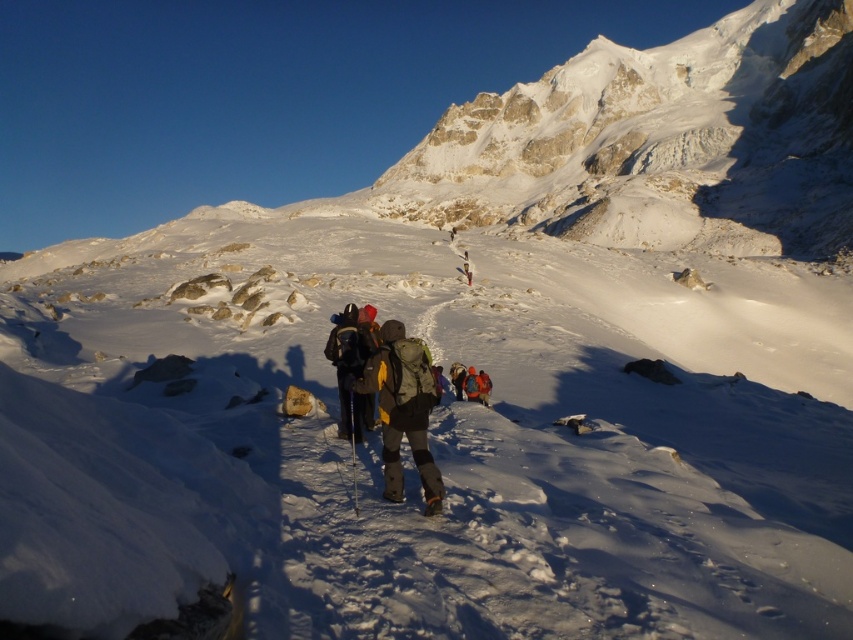
Does matte gray jacket at center have a larger size compared to matte black backpack at center?

Incorrect, matte gray jacket at center is not larger than matte black backpack at center.

Where is `matte gray jacket at center`? Image resolution: width=853 pixels, height=640 pixels. matte gray jacket at center is located at coordinates tap(403, 410).

Is point (387, 353) closer to viewer compared to point (354, 401)?

Yes, point (387, 353) is in front of point (354, 401).

Where is `matte gray jacket at center`? matte gray jacket at center is located at coordinates (403, 410).